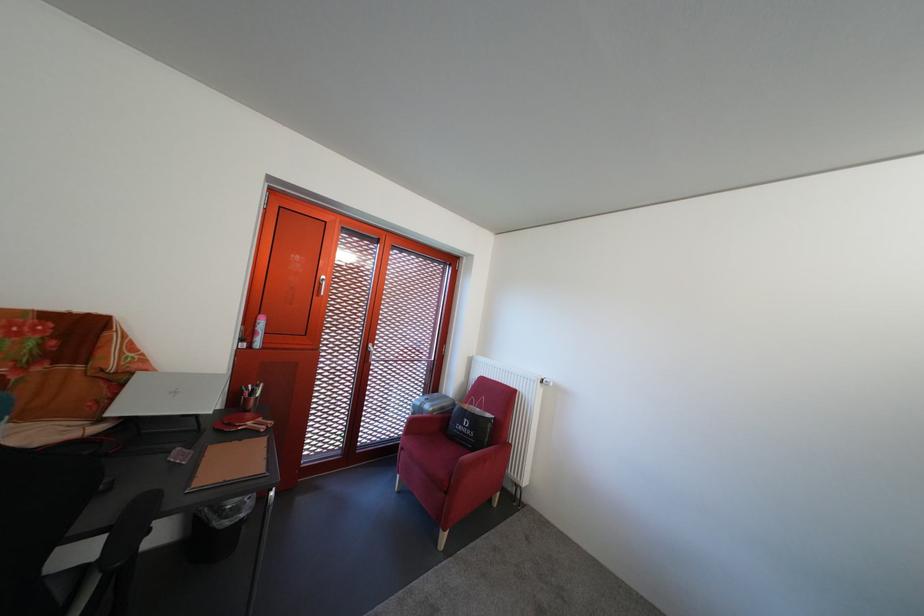
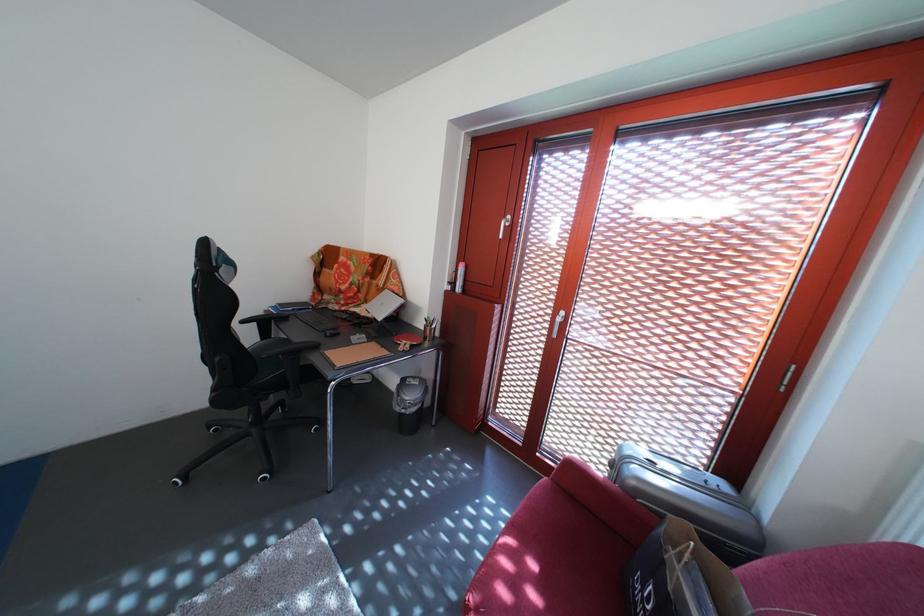
The point at (237, 530) is marked in the first image. Where is the corresponding point in the second image?

(408, 416)